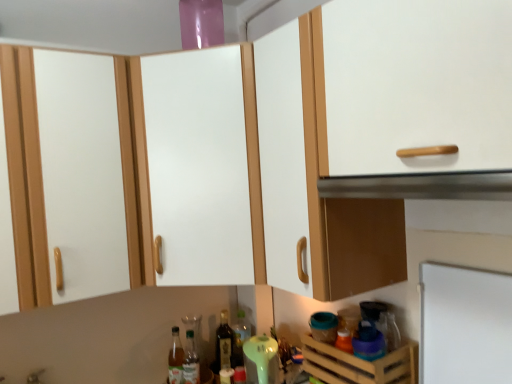
Question: From a real-world perspective, is white matte cabinet at center beneath clear glass bottle at lower center, placed as the third bottle when sorted from right to left?

Choices:
 (A) yes
 (B) no

Answer: (B)

Question: Can you confirm if white matte cabinet at center is taller than clear glass bottle at lower center, which is the 1th bottle from left to right?

Choices:
 (A) yes
 (B) no

Answer: (A)

Question: Is white matte cabinet at center to the left of clear glass bottle at lower center, which is the 1th bottle from left to right, from the viewer's perspective?

Choices:
 (A) no
 (B) yes

Answer: (A)

Question: Is white matte cabinet at center facing towards clear glass bottle at lower center, placed as the third bottle when sorted from right to left?

Choices:
 (A) yes
 (B) no

Answer: (B)

Question: Would you consider white matte cabinet at center to be distant from clear glass bottle at lower center, which is the 1th bottle from left to right?

Choices:
 (A) yes
 (B) no

Answer: (B)

Question: Is white matte cabinet at center shorter than clear glass bottle at lower center, placed as the third bottle when sorted from right to left?

Choices:
 (A) no
 (B) yes

Answer: (A)

Question: Is wooden crate at lower right turned away from white matte cabinet at center?

Choices:
 (A) no
 (B) yes

Answer: (A)

Question: Does wooden crate at lower right have a lesser height compared to white matte cabinet at center?

Choices:
 (A) yes
 (B) no

Answer: (A)

Question: Considering the relative sizes of wooden crate at lower right and white matte cabinet at center in the image provided, is wooden crate at lower right bigger than white matte cabinet at center?

Choices:
 (A) yes
 (B) no

Answer: (B)

Question: Can you confirm if wooden crate at lower right is wider than white matte cabinet at center?

Choices:
 (A) no
 (B) yes

Answer: (A)

Question: Can you confirm if wooden crate at lower right is positioned to the right of white matte cabinet at center?

Choices:
 (A) yes
 (B) no

Answer: (A)

Question: Is white matte cabinet at center completely or partially inside wooden crate at lower right?

Choices:
 (A) no
 (B) yes

Answer: (A)

Question: From a real-world perspective, is shiny dark glass bottle at center, placed as the second bottle when sorted from right to left, over white matte cabinet at center?

Choices:
 (A) no
 (B) yes

Answer: (A)